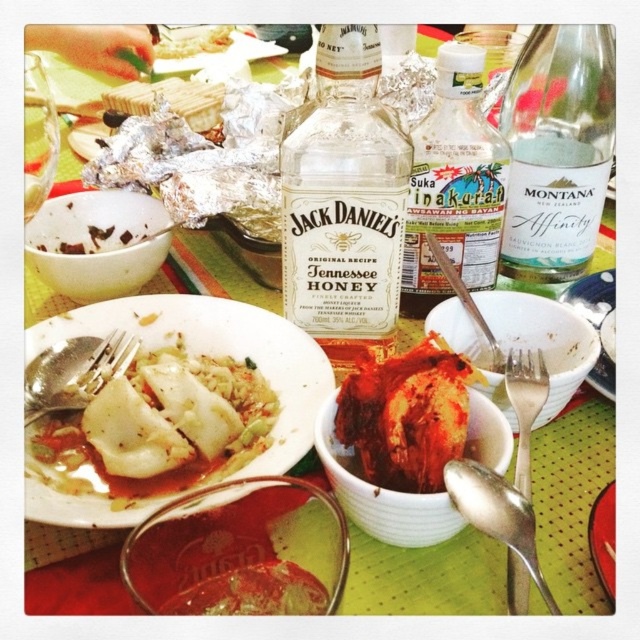
Question: From the image, what is the correct spatial relationship of translucent glass bottle at center in relation to white matte bowl at upper left?

Choices:
 (A) above
 (B) below

Answer: (A)

Question: Considering the relative positions of white dumpling at center and matte white bowl at center in the image provided, where is white dumpling at center located with respect to matte white bowl at center?

Choices:
 (A) left
 (B) right

Answer: (A)

Question: Which point appears farthest from the camera in this image?

Choices:
 (A) (458, 321)
 (B) (80, 289)
 (C) (524, 440)
 (D) (326, 97)

Answer: (B)

Question: Which object is positioned farthest from the white creamy rice at upper center?

Choices:
 (A) clear glass bottle at upper right
 (B) translucent glass bottle at center

Answer: (B)

Question: Which object is closer to the camera taking this photo?

Choices:
 (A) white matte bowl at upper left
 (B) white ceramic bowl at center

Answer: (B)

Question: Is red glossy chicken at center above silver metallic fork at lower right?

Choices:
 (A) no
 (B) yes

Answer: (B)